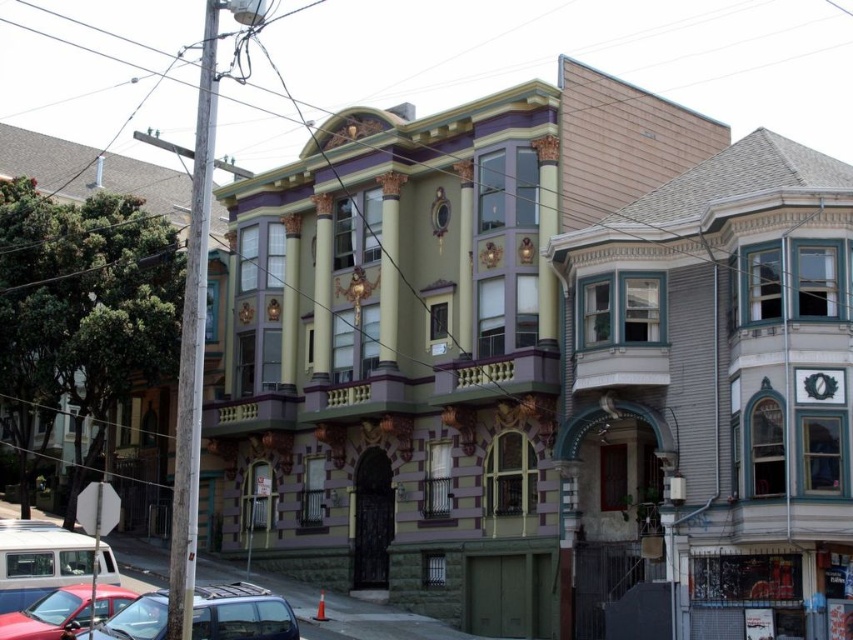
You are a delivery person approaching the Victorian building and need to park your vehicle. You see two cars parked at the lower left of the image. Which car is closer to the center of the street, the shiny black car at lower left or the shiny red car at lower left?

The shiny red car at lower left is closer to the center of the street because the shiny black car at lower left is positioned to its right, meaning the red car is on the left side and thus nearer to the center.

You are a delivery driver who needs to park your truck, which is 6 meters long, in the street in front of the Victorian building. You see the shiny black car at lower left and the shiny red car at lower left. Can you determine if there is enough space between them to park your truck?

The shiny black car at lower left is larger in size than the shiny red car at lower left, but the exact distance between them is not provided. Without knowing the distance between the two cars, it is impossible to determine if there is enough space for the truck.